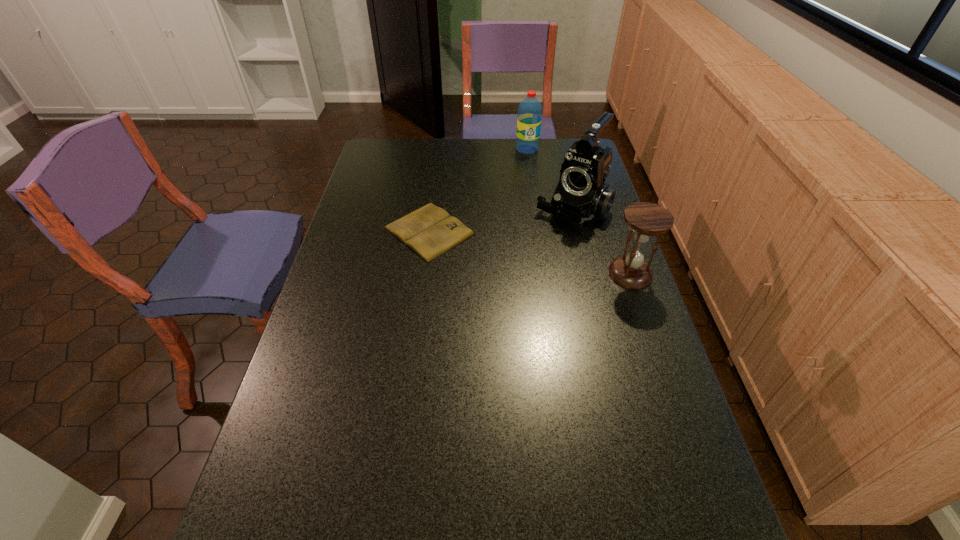
You are a GUI agent. You are given a task and a screenshot of the screen. Output one action in this format:
    pyautogui.click(x=<x>, y=<y>)
    Task: Click on the vacant region located 0.130m on the front label of the farthest object
    
    Given the screenshot: What is the action you would take?
    pyautogui.click(x=525, y=172)

This screenshot has height=540, width=960. I want to click on free space located on the front label of the farthest object, so click(x=522, y=206).

In order to click on free space located 0.300m on the front label of the farthest object in this screenshot , I will do `click(523, 197)`.

The height and width of the screenshot is (540, 960). Identify the location of object that is at the far edge. (529, 119).

At what (x,y) coordinates should I click in order to perform the action: click on object that is at the left edge. Please return your answer as a coordinate pair (x, y). This screenshot has width=960, height=540. Looking at the image, I should click on pyautogui.click(x=430, y=231).

Where is `hourglass positioned at the right edge`? Image resolution: width=960 pixels, height=540 pixels. hourglass positioned at the right edge is located at coordinates [x=646, y=219].

What are the coordinates of `camcorder that is positioned at the right edge` in the screenshot? It's located at (581, 194).

This screenshot has width=960, height=540. In the image, there is a desktop. Identify the location of vacant region at the far edge. (411, 145).

This screenshot has width=960, height=540. Identify the location of free space at the left edge. (359, 201).

Where is `free space at the right edge of the desktop`? This screenshot has height=540, width=960. free space at the right edge of the desktop is located at coordinates (627, 459).